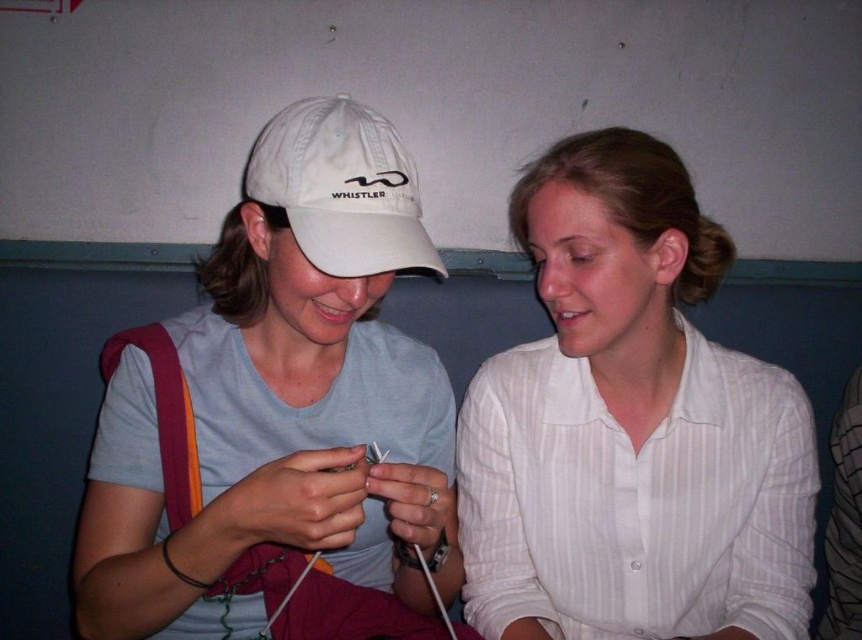
Does point (528, 632) lie in front of point (272, 145)?

That is False.

Which is below, white striped shirt at center or white fabric baseball cap at center?

white striped shirt at center is below.

What do you see at coordinates (629, 428) in the screenshot?
I see `white striped shirt at center` at bounding box center [629, 428].

Identify the location of white striped shirt at center. The width and height of the screenshot is (862, 640). (629, 428).

Which is more to the right, white cotton cap at upper left or white striped shirt at center?

Positioned to the right is white striped shirt at center.

Is white cotton cap at upper left wider than white striped shirt at center?

In fact, white cotton cap at upper left might be narrower than white striped shirt at center.

Locate an element on the screen. The width and height of the screenshot is (862, 640). white cotton cap at upper left is located at coordinates (280, 417).

Is white cotton cap at upper left to the left of white fabric baseball cap at center from the viewer's perspective?

Yes, white cotton cap at upper left is to the left of white fabric baseball cap at center.

Does white cotton cap at upper left have a lesser height compared to white fabric baseball cap at center?

Incorrect, white cotton cap at upper left's height does not fall short of white fabric baseball cap at center's.

The width and height of the screenshot is (862, 640). Describe the element at coordinates (280, 417) in the screenshot. I see `white cotton cap at upper left` at that location.

Locate an element on the screen. The height and width of the screenshot is (640, 862). white cotton cap at upper left is located at coordinates (280, 417).